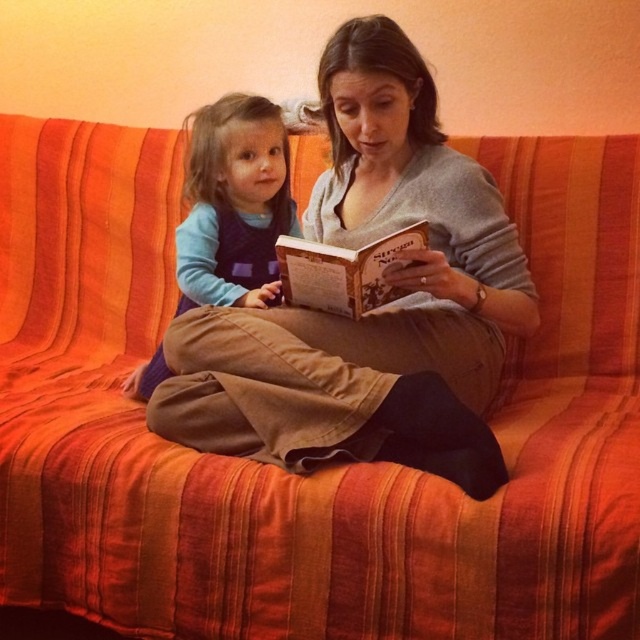
Does blue fleece top at upper left have a greater width compared to brown paper at center?

Yes, blue fleece top at upper left is wider than brown paper at center.

Find the location of a particular element. blue fleece top at upper left is located at coordinates (234, 204).

This screenshot has height=640, width=640. Find the location of `blue fleece top at upper left`. blue fleece top at upper left is located at coordinates (234, 204).

Between matte gray sweater at center and brown paper at center, which one has less height?

brown paper at center is shorter.

Does matte gray sweater at center have a smaller size compared to brown paper at center?

No, matte gray sweater at center is not smaller than brown paper at center.

The image size is (640, 640). I want to click on matte gray sweater at center, so click(376, 310).

I want to click on matte gray sweater at center, so click(x=376, y=310).

Which is more to the left, matte gray sweater at center or blue fleece top at upper left?

blue fleece top at upper left

Between point (356, 323) and point (252, 253), which one is positioned behind?

The point (252, 253) is behind.

You are a GUI agent. You are given a task and a screenshot of the screen. Output one action in this format:
    pyautogui.click(x=<x>, y=<y>)
    Task: Click on the matte gray sweater at center
    The image size is (640, 640).
    Given the screenshot: What is the action you would take?
    pyautogui.click(x=376, y=310)